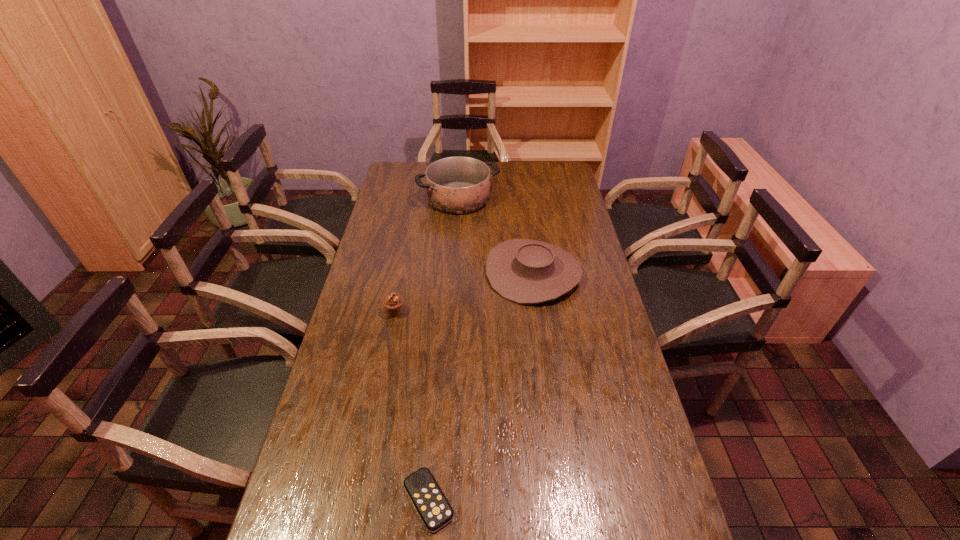
Where is `free space between the saucepan and the nearest object`? The image size is (960, 540). free space between the saucepan and the nearest object is located at coordinates (444, 349).

At what (x,y) coordinates should I click in order to perform the action: click on free spot between the muffin and the cowboy hat. Please return your answer as a coordinate pair (x, y). Looking at the image, I should click on (464, 293).

Identify the location of unoccupied position between the cowboy hat and the muffin. (464, 293).

Locate an element on the screen. This screenshot has height=540, width=960. vacant point located between the remote control and the muffin is located at coordinates tap(412, 406).

This screenshot has height=540, width=960. In order to click on free point between the cowboy hat and the saucepan in this screenshot , I will do coord(496,235).

Identify the location of vacant space that's between the saucepan and the nearest object. The image size is (960, 540). (444, 349).

Identify the location of free space between the shortest object and the muffin. The height and width of the screenshot is (540, 960). (412, 406).

Find the location of a particular element. This screenshot has height=540, width=960. free space between the remote control and the saucepan is located at coordinates (444, 349).

Where is `free space between the nearest object and the cowboy hat`? This screenshot has width=960, height=540. free space between the nearest object and the cowboy hat is located at coordinates (481, 387).

Identify which object is the third nearest to the remote control. Please provide its 2D coordinates. Your answer should be formatted as a tuple, i.e. [(x, y)], where the tuple contains the x and y coordinates of a point satisfying the conditions above.

[(458, 185)]